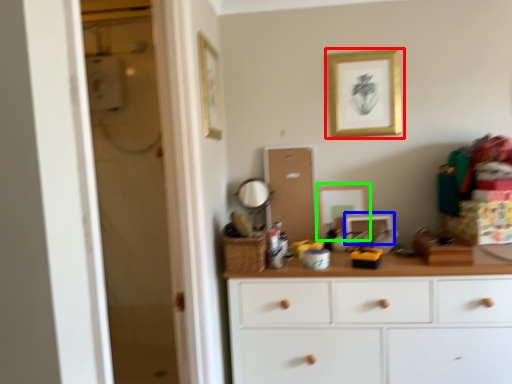
Question: Which is farther away from picture frame (highlighted by a red box)? picture frame (highlighted by a blue box) or picture frame (highlighted by a green box)?

Choices:
 (A) picture frame
 (B) picture frame

Answer: (A)